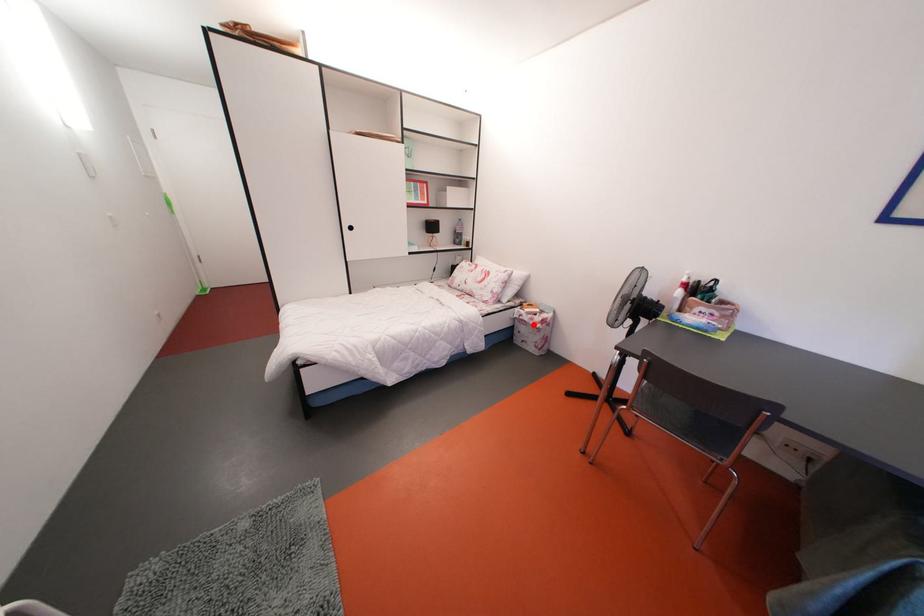
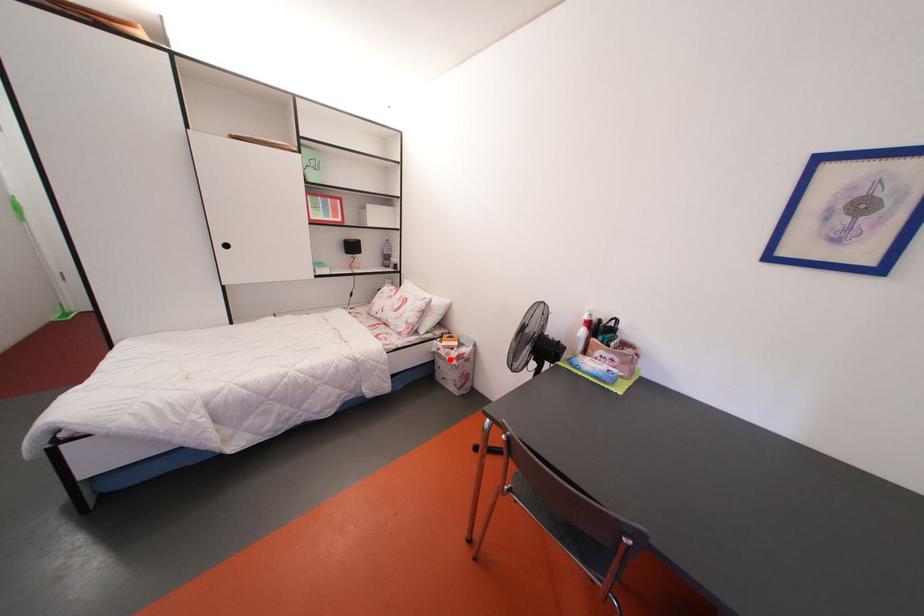
I am providing you with two images of the same scene from different viewpoints. A red point is marked on the first image and another point is marked on the second image. Do the highlighted points in image1 and image2 indicate the same real-world spot?

Yes